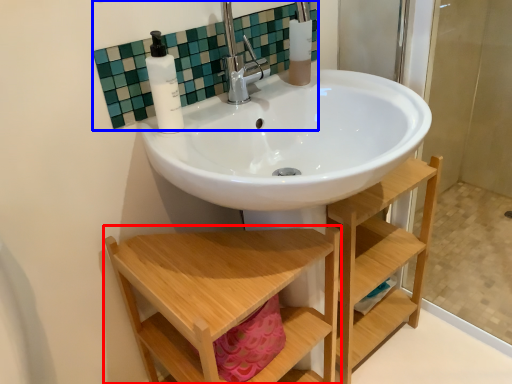
Question: Which object is closer to the camera taking this photo, furniture (highlighted by a red box) or mirror (highlighted by a blue box)?

Choices:
 (A) furniture
 (B) mirror

Answer: (A)